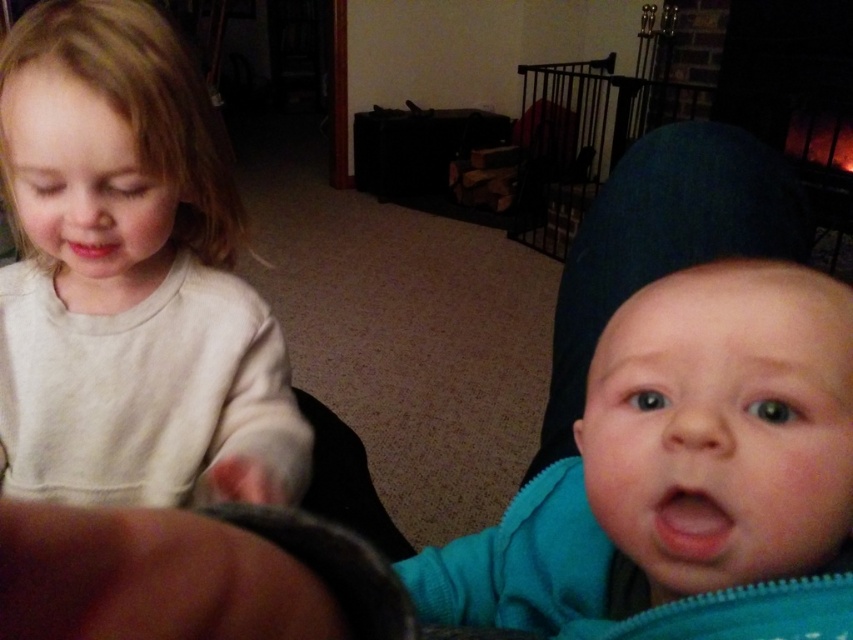
What do you see at coordinates (129, 275) in the screenshot? I see `light beige sweater at left` at bounding box center [129, 275].

At what (x,y) coordinates should I click in order to perform the action: click on light beige sweater at left. Please return your answer as a coordinate pair (x, y). The image size is (853, 640). Looking at the image, I should click on (129, 275).